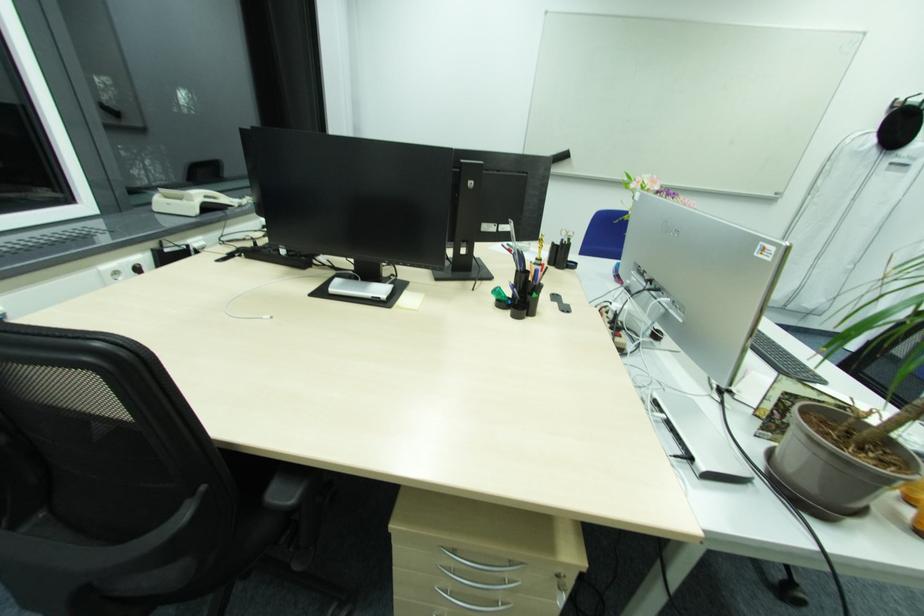
Locate an element on the screen. brown plant pot is located at coordinates (834, 464).